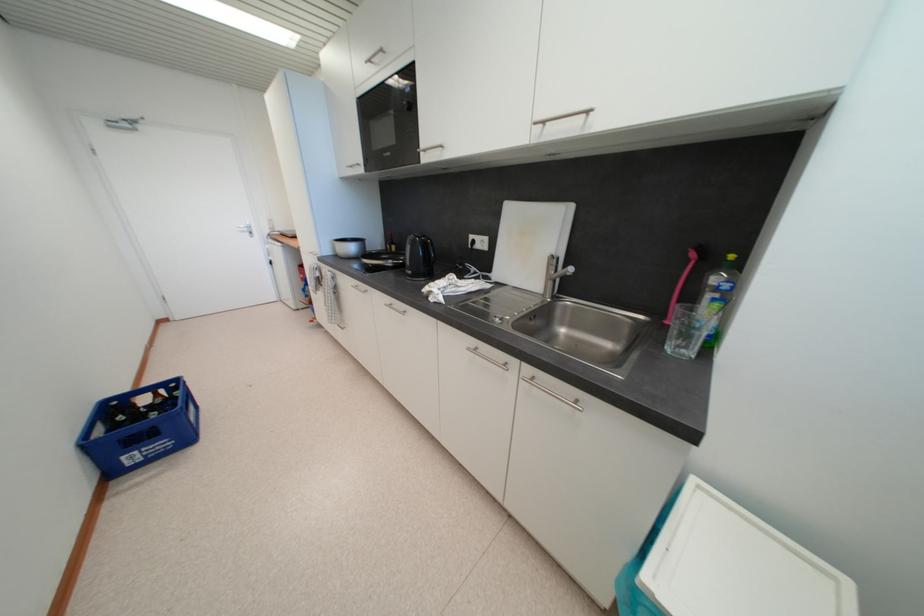
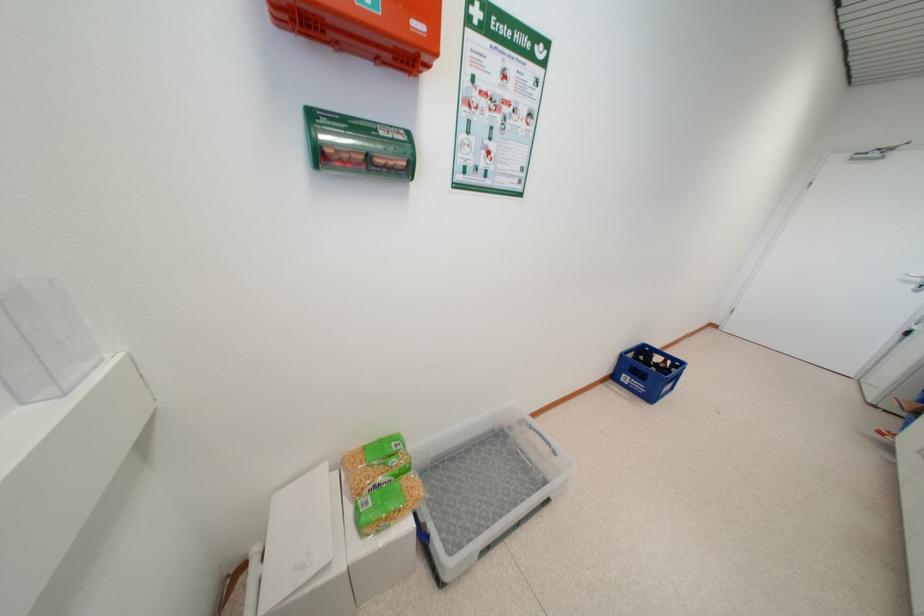
Locate, in the second image, the point that corresponds to the point at 248,235 in the first image.

(912, 284)